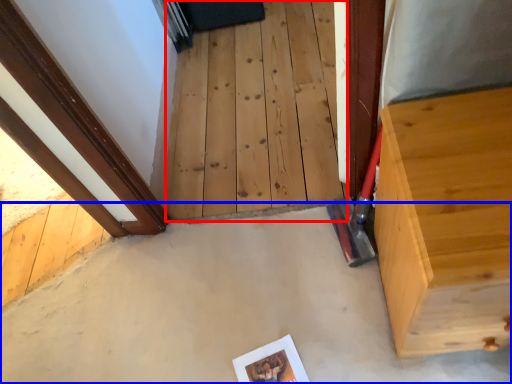
Question: Which object is closer to the camera taking this photo, stairwell (highlighted by a red box) or concrete (highlighted by a blue box)?

Choices:
 (A) stairwell
 (B) concrete

Answer: (B)